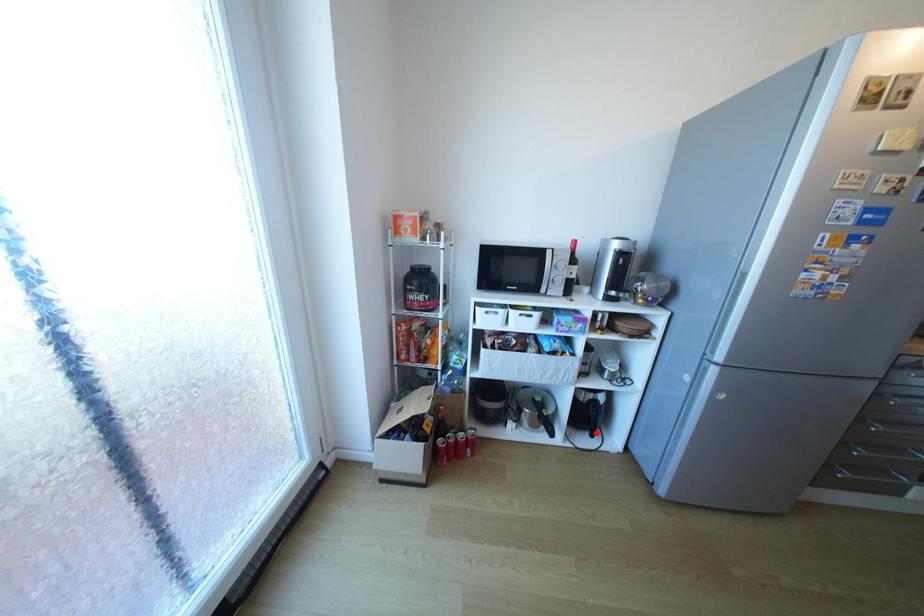
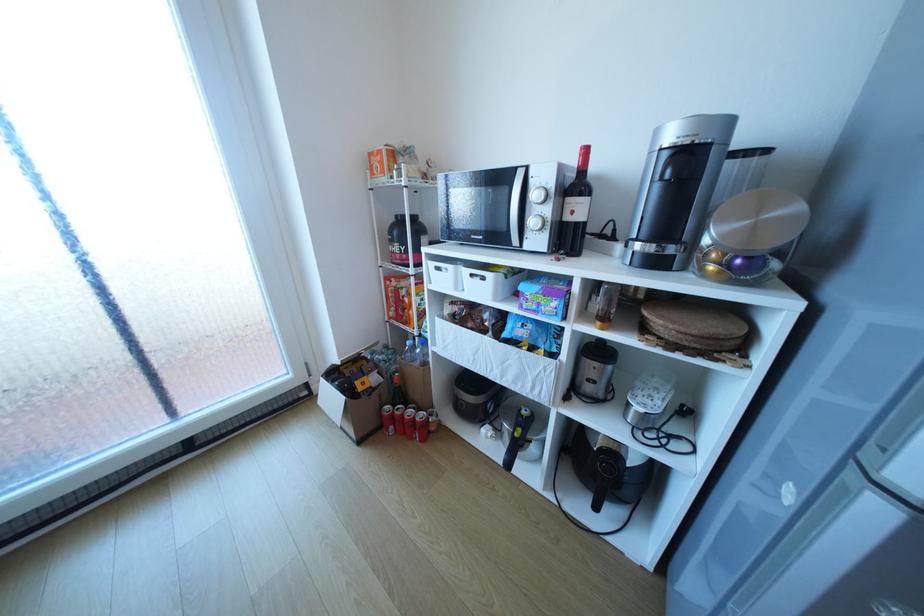
In the second image, find the point that corresponds to the highlighted location in the first image.

(599, 499)